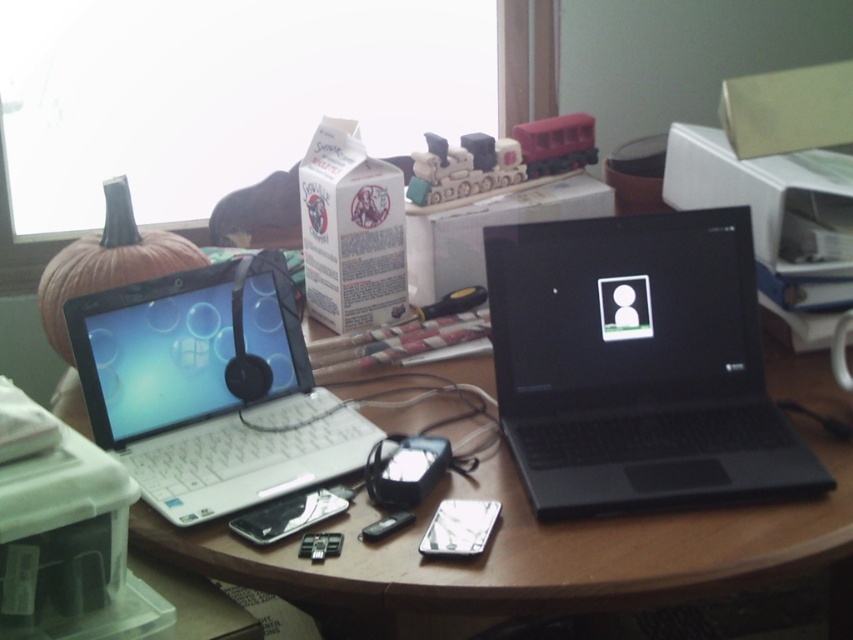
Is black matte laptop at center wider than white glossy round table at center?

No, black matte laptop at center is not wider than white glossy round table at center.

Who is positioned more to the left, black matte laptop at center or white glossy round table at center?

white glossy round table at center is more to the left.

Which is behind, point (552, 291) or point (318, 580)?

Point (552, 291)

Locate an element on the screen. black matte laptop at center is located at coordinates (636, 364).

How much distance is there between black matte laptop at center and white plastic laptop at left?

black matte laptop at center and white plastic laptop at left are 15.62 inches apart from each other.

Who is positioned more to the left, black matte laptop at center or white plastic laptop at left?

white plastic laptop at left is more to the left.

Does point (653, 317) come behind point (138, 387)?

Yes, it is behind point (138, 387).

The image size is (853, 640). Find the location of `black matte laptop at center`. black matte laptop at center is located at coordinates (636, 364).

Is white glossy round table at center closer to camera compared to white plastic laptop at left?

Yes, white glossy round table at center is closer to the viewer.

Is point (332, 584) farther from viewer compared to point (225, 333)?

No.

Is point (486, 572) positioned after point (305, 380)?

No, it is not.

Find the location of a particular element. Image resolution: width=853 pixels, height=640 pixels. white glossy round table at center is located at coordinates (538, 554).